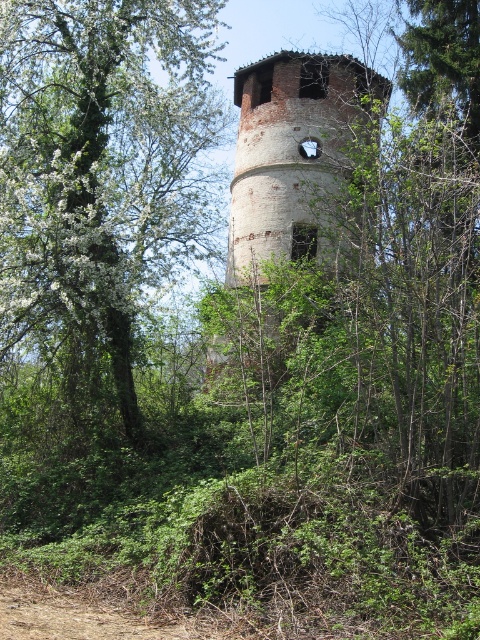
Question: Does green leafy tree at center have a lesser width compared to brick tower at center?

Choices:
 (A) yes
 (B) no

Answer: (A)

Question: Is green leafy tree at center positioned at the back of brick tower at center?

Choices:
 (A) no
 (B) yes

Answer: (A)

Question: Among these points, which one is nearest to the camera?

Choices:
 (A) (289, 80)
 (B) (36, 99)

Answer: (B)

Question: Observing the image, what is the correct spatial positioning of green leafy tree at center in reference to brick tower at center?

Choices:
 (A) left
 (B) right

Answer: (A)

Question: Which point is farther to the camera?

Choices:
 (A) (327, 115)
 (B) (103, 147)

Answer: (A)